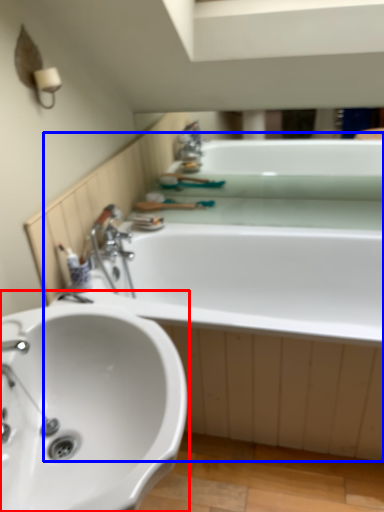
Question: Among these objects, which one is farthest to the camera, sink (highlighted by a red box) or bath (highlighted by a blue box)?

Choices:
 (A) sink
 (B) bath

Answer: (B)